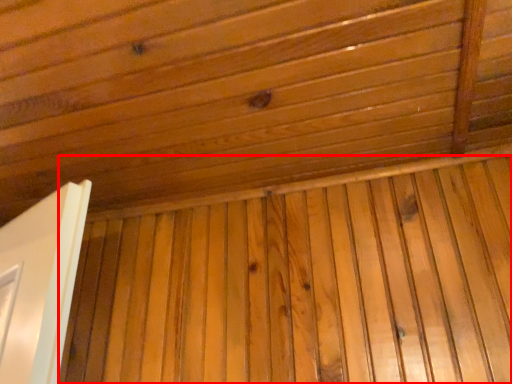
Question: From the image's perspective, what is the correct spatial positioning of plywood (annotated by the red box) in reference to roof?

Choices:
 (A) above
 (B) below

Answer: (B)